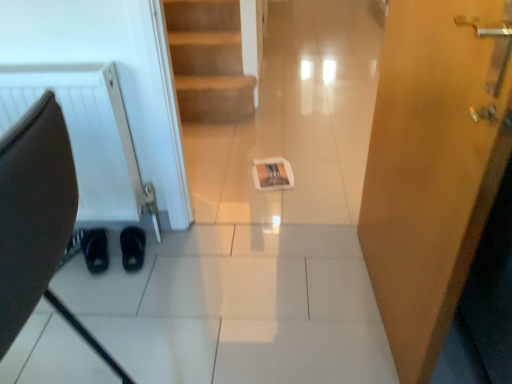
This screenshot has width=512, height=384. What do you see at coordinates (84, 133) in the screenshot?
I see `white textured radiator at left` at bounding box center [84, 133].

Identify the location of brown leather swivel chair at left. Image resolution: width=512 pixels, height=384 pixels. (37, 220).

This screenshot has width=512, height=384. What do you see at coordinates (95, 250) in the screenshot? I see `black suede shoes at lower left, which is the 2th footwear in right-to-left order` at bounding box center [95, 250].

Find the location of a particular element. This screenshot has width=512, height=384. wooden door at right is located at coordinates (433, 165).

Image resolution: width=512 pixels, height=384 pixels. In order to click on black suede shoes at lower left, the first footwear positioned from the right in this screenshot , I will do `click(132, 248)`.

In the scene shown: Does black suede shoes at lower left, the first footwear positioned from the right, turn towards white textured radiator at left?

Yes, black suede shoes at lower left, the first footwear positioned from the right, is oriented towards white textured radiator at left.

Can you see black suede shoes at lower left, the first footwear positioned from the right, touching white textured radiator at left?

No, black suede shoes at lower left, the first footwear positioned from the right, is not next to white textured radiator at left.

Considering the relative positions of black suede shoes at lower left, the first footwear positioned from the right, and white textured radiator at left in the image provided, is black suede shoes at lower left, the first footwear positioned from the right, behind white textured radiator at left?

That is True.

The image size is (512, 384). In the image, there is a black suede shoes at lower left, the first footwear positioned from the right. What are the coordinates of `radiator above it (from the image's perspective)` in the screenshot? It's located at (84, 133).

From a real-world perspective, who is located higher, wooden door at right or black suede shoes at lower left, which is the second footwear from left to right?

wooden door at right.

Looking at this image, between wooden door at right and black suede shoes at lower left, the first footwear positioned from the right, which one has more height?

wooden door at right is taller.

Is wooden door at right at the right side of black suede shoes at lower left, the first footwear positioned from the right?

Indeed, wooden door at right is positioned on the right side of black suede shoes at lower left, the first footwear positioned from the right.

Between wooden door at right and black suede shoes at lower left, the first footwear positioned from the right, which one has smaller size?

Smaller between the two is black suede shoes at lower left, the first footwear positioned from the right.

Which of these two, brown leather swivel chair at left or black suede shoes at lower left, the first footwear positioned from the right, is smaller?

black suede shoes at lower left, the first footwear positioned from the right, is smaller.

Between brown leather swivel chair at left and black suede shoes at lower left, which is the second footwear from left to right, which one appears on the right side from the viewer's perspective?

brown leather swivel chair at left.

Is brown leather swivel chair at left wider than black suede shoes at lower left, the first footwear positioned from the right?

Indeed, brown leather swivel chair at left has a greater width compared to black suede shoes at lower left, the first footwear positioned from the right.

Looking at their sizes, would you say wooden door at right is wider or thinner than black suede shoes at lower left, the first footwear from the left?

In the image, wooden door at right appears to be more narrow than black suede shoes at lower left, the first footwear from the left.

Is wooden door at right positioned far away from black suede shoes at lower left, which is the 2th footwear in right-to-left order?

wooden door at right is far away from black suede shoes at lower left, which is the 2th footwear in right-to-left order.

In the scene shown: How many degrees apart are the facing directions of wooden door at right and black suede shoes at lower left, the first footwear from the left?

The facing directions of wooden door at right and black suede shoes at lower left, the first footwear from the left, are 112 degrees apart.

From the picture: Is wooden door at right turned away from black suede shoes at lower left, the first footwear from the left?

wooden door at right does not have its back to black suede shoes at lower left, the first footwear from the left.

Considering the relative positions of white textured radiator at left and matte paper magazine at center in the image provided, is white textured radiator at left to the right of matte paper magazine at center from the viewer's perspective?

No.

Considering the sizes of objects white textured radiator at left and matte paper magazine at center in the image provided, who is shorter, white textured radiator at left or matte paper magazine at center?

Standing shorter between the two is matte paper magazine at center.

Is white textured radiator at left wider than matte paper magazine at center?

Incorrect, the width of white textured radiator at left does not surpass that of matte paper magazine at center.

Are white textured radiator at left and matte paper magazine at center far apart?

No, white textured radiator at left is in close proximity to matte paper magazine at center.

Can you tell me how much brown leather swivel chair at left and matte paper magazine at center differ in facing direction?

88 degrees separate the facing orientations of brown leather swivel chair at left and matte paper magazine at center.

Can you confirm if brown leather swivel chair at left is bigger than matte paper magazine at center?

Yes.

Considering the sizes of brown leather swivel chair at left and matte paper magazine at center in the image, is brown leather swivel chair at left wider or thinner than matte paper magazine at center?

brown leather swivel chair at left is wider than matte paper magazine at center.

The width and height of the screenshot is (512, 384). Find the location of `radiator beneath the brown leather swivel chair at left (from a real-world perspective)`. radiator beneath the brown leather swivel chair at left (from a real-world perspective) is located at coordinates (84, 133).

From a real-world perspective, which object stands above the other?

brown leather swivel chair at left is physically above.

Would you consider brown leather swivel chair at left to be distant from white textured radiator at left?

brown leather swivel chair at left is far away from white textured radiator at left.

Where is `footwear that is the 2nd one when counting rightward from the white textured radiator at left`? footwear that is the 2nd one when counting rightward from the white textured radiator at left is located at coordinates (132, 248).

From the image's perspective, which footwear is the 1st one below the wooden door at right? Please provide its 2D coordinates.

[(132, 248)]

Considering their positions, is white textured radiator at left positioned closer to wooden door at right than matte paper magazine at center?

matte paper magazine at center.

Estimate the real-world distances between objects in this image. Which object is further from matte paper magazine at center, white textured radiator at left or wooden door at right?

Among the two, wooden door at right is located further to matte paper magazine at center.

Estimate the real-world distances between objects in this image. Which object is closer to wooden door at right, matte paper magazine at center or black suede shoes at lower left, the first footwear positioned from the right?

Based on the image, matte paper magazine at center appears to be nearer to wooden door at right.

Based on their spatial positions, is white textured radiator at left or brown leather swivel chair at left closer to matte paper magazine at center?

white textured radiator at left lies closer to matte paper magazine at center than the other object.

Estimate the real-world distances between objects in this image. Which object is further from wooden door at right, white textured radiator at left or black suede shoes at lower left, which is the 2th footwear in right-to-left order?

black suede shoes at lower left, which is the 2th footwear in right-to-left order, is further to wooden door at right.

Looking at this image, from the image, which object appears to be nearer to matte paper magazine at center, brown leather swivel chair at left or black suede shoes at lower left, the first footwear positioned from the right?

black suede shoes at lower left, the first footwear positioned from the right, lies closer to matte paper magazine at center than the other object.

Estimate the real-world distances between objects in this image. Which object is further from black suede shoes at lower left, the first footwear positioned from the right, white textured radiator at left or brown leather swivel chair at left?

The object further to black suede shoes at lower left, the first footwear positioned from the right, is brown leather swivel chair at left.

In the scene shown: Estimate the real-world distances between objects in this image. Which object is closer to matte paper magazine at center, brown leather swivel chair at left or black suede shoes at lower left, which is the 2th footwear in right-to-left order?

black suede shoes at lower left, which is the 2th footwear in right-to-left order.

You are a GUI agent. You are given a task and a screenshot of the screen. Output one action in this format:
    pyautogui.click(x=<x>, y=<y>)
    Task: Click on the radiator positioned between brown leather swivel chair at left and matte paper magazine at center from near to far
    The width and height of the screenshot is (512, 384).
    Given the screenshot: What is the action you would take?
    pyautogui.click(x=84, y=133)

Image resolution: width=512 pixels, height=384 pixels. What are the coordinates of `swivel chair between white textured radiator at left and wooden door at right in the horizontal direction` in the screenshot? It's located at tap(37, 220).

This screenshot has height=384, width=512. What are the coordinates of `door positioned between brown leather swivel chair at left and black suede shoes at lower left, the first footwear from the left, from near to far` in the screenshot? It's located at (433, 165).

Find the location of `footwear positioned between brown leather swivel chair at left and black suede shoes at lower left, the first footwear positioned from the right, from near to far`. footwear positioned between brown leather swivel chair at left and black suede shoes at lower left, the first footwear positioned from the right, from near to far is located at coordinates [95, 250].